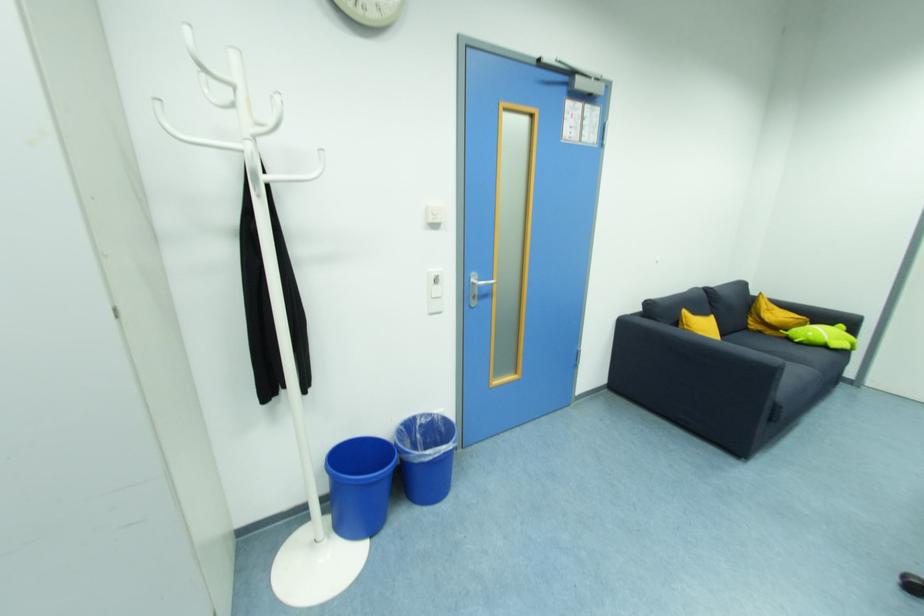
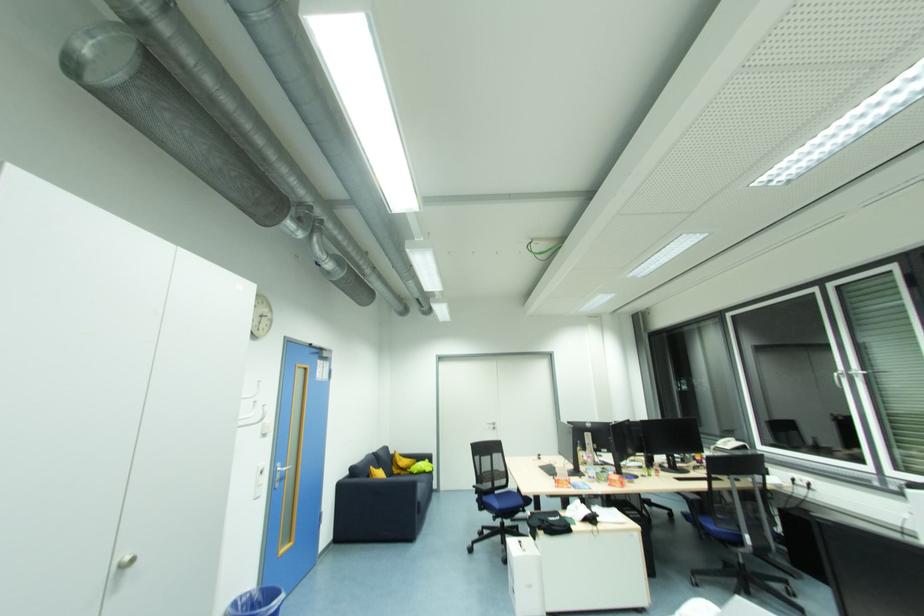
Find the pixel in the second image that matches (678,323) in the first image.

(371, 477)